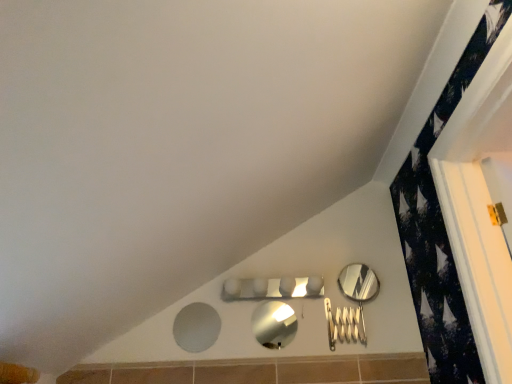
Question: Considering the positions of point (196, 332) and point (369, 279), is point (196, 332) closer or farther from the camera than point (369, 279)?

Choices:
 (A) farther
 (B) closer

Answer: (B)

Question: From the image's perspective, is matte gray mirror at lower center, the 1th mirror positioned from the left, above or below polished silver mirror at right, which appears as the 1th mirror when viewed from the right?

Choices:
 (A) below
 (B) above

Answer: (A)

Question: Considering the real-world distances, which object is closest to the metallic silver mirror at center, which is the 2th mirror in left-to-right order?

Choices:
 (A) polished silver mirror at right, the third mirror in the left-to-right sequence
 (B) matte gray mirror at lower center, the third mirror positioned from the right

Answer: (B)

Question: Estimate the real-world distances between objects in this image. Which object is farther from the metallic silver mirror at center, the second mirror in the right-to-left sequence?

Choices:
 (A) polished silver mirror at right, which appears as the 1th mirror when viewed from the right
 (B) matte gray mirror at lower center, the third mirror positioned from the right

Answer: (A)